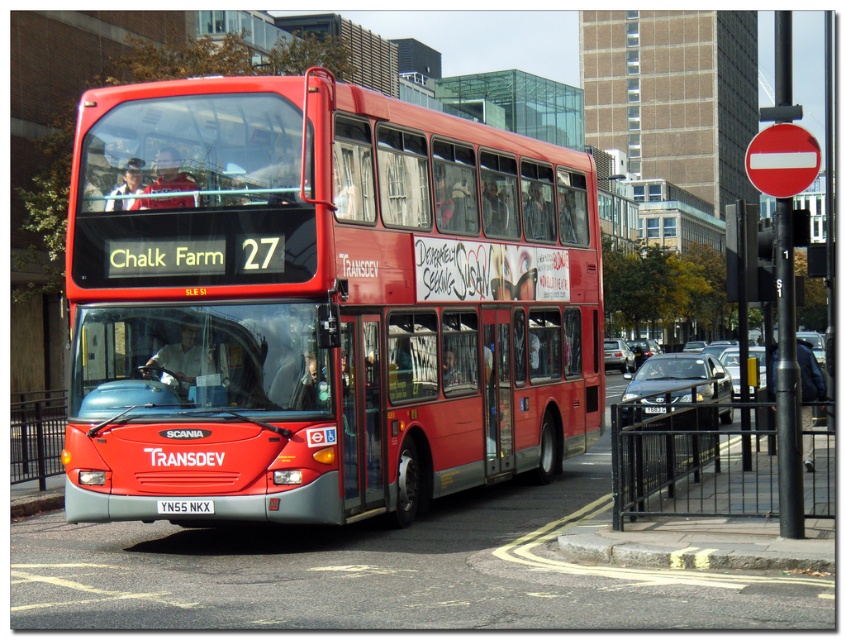
Question: Which point appears farthest from the camera in this image?

Choices:
 (A) (196, 506)
 (B) (786, 141)
 (C) (569, 266)

Answer: (C)

Question: Can you confirm if matte red bus at center is positioned above yellow metallic license plate at center?

Choices:
 (A) no
 (B) yes

Answer: (B)

Question: Which object is the farthest from the yellow metallic license plate at center?

Choices:
 (A) red plastic circle at upper right
 (B) brown concrete curb at lower center
 (C) matte red bus at center

Answer: (A)

Question: Is matte red bus at center smaller than black metal fence at lower right?

Choices:
 (A) yes
 (B) no

Answer: (B)

Question: Is black metal fence at lower right further to camera compared to yellow metallic license plate at center?

Choices:
 (A) no
 (B) yes

Answer: (A)

Question: Based on their relative distances, which object is farther from the black metal fence at lower right?

Choices:
 (A) red plastic circle at upper right
 (B) yellow metallic license plate at center
 (C) matte red bus at center
 (D) brown concrete curb at lower center

Answer: (B)